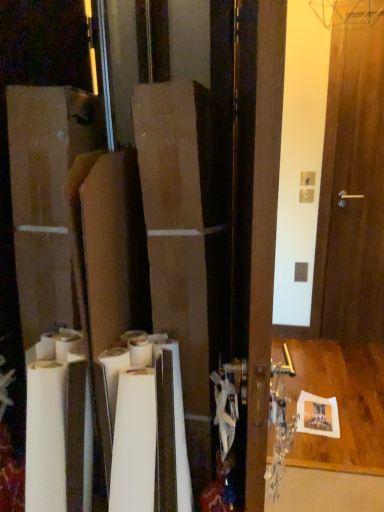
What do you see at coordinates (352, 188) in the screenshot?
I see `brown wooden door at right` at bounding box center [352, 188].

The height and width of the screenshot is (512, 384). Identify the location of brown wooden door at right. (352, 188).

The height and width of the screenshot is (512, 384). Identify the location of brown wooden door at right. 352,188.